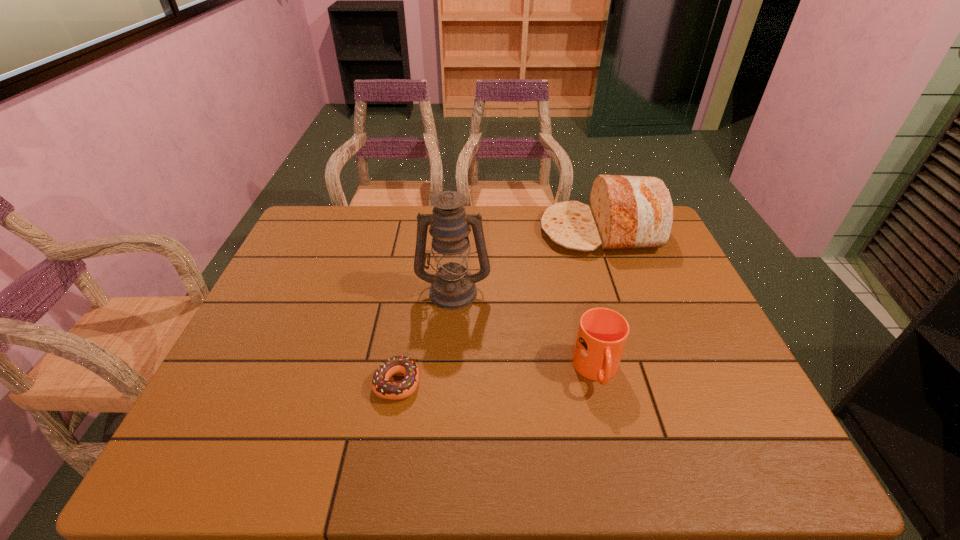
Identify the location of oil lamp. The image size is (960, 540). 452,287.

Where is `the tallest object`? the tallest object is located at coordinates (452, 287).

The width and height of the screenshot is (960, 540). I want to click on the farthest object, so click(626, 212).

The image size is (960, 540). I want to click on bread, so click(x=626, y=212).

The image size is (960, 540). In order to click on mug in this screenshot , I will do `click(602, 334)`.

Find the location of a particular element. The height and width of the screenshot is (540, 960). doughnut is located at coordinates pos(381,386).

Where is `blank space located 0.390m on the left of the tallest object`? This screenshot has height=540, width=960. blank space located 0.390m on the left of the tallest object is located at coordinates (277, 291).

At what (x,y) coordinates should I click in order to perform the action: click on free spot located at the sliced end of the third shortest object. Please return your answer as a coordinate pair (x, y). Image resolution: width=960 pixels, height=540 pixels. Looking at the image, I should click on (468, 231).

You are a GUI agent. You are given a task and a screenshot of the screen. Output one action in this format:
    pyautogui.click(x=<x>, y=<y>)
    Task: Click on the vacant space located at the sliced end of the third shortest object
    
    Given the screenshot: What is the action you would take?
    pyautogui.click(x=437, y=231)

This screenshot has width=960, height=540. In order to click on free region located 0.060m at the sliced end of the third shortest object in this screenshot , I will do `click(522, 231)`.